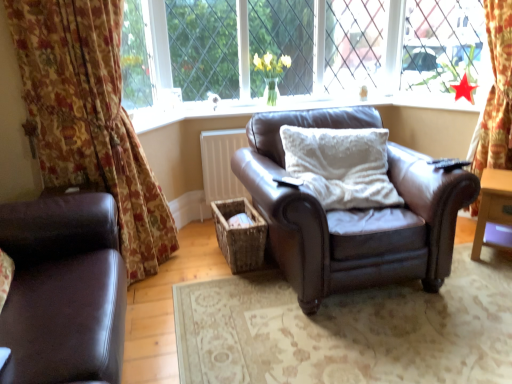
What do you see at coordinates (289, 107) in the screenshot? I see `matte brown leather armchair at center` at bounding box center [289, 107].

This screenshot has height=384, width=512. What do you see at coordinates (89, 117) in the screenshot?
I see `floral fabric curtain at left` at bounding box center [89, 117].

Measure the distance between point (x=441, y=24) and camera.

The distance of point (x=441, y=24) from camera is 10.40 feet.

Find the location of a particular element. The width and height of the screenshot is (512, 384). matte brown leather armchair at center is located at coordinates (289, 107).

Which of these two, woven brown basket at center or floral fabric curtain at left, is bigger?

floral fabric curtain at left.

Is point (225, 211) positioned behind point (72, 152)?

Yes, point (225, 211) is behind point (72, 152).

From a real-world perspective, who is located higher, woven brown basket at center or floral fabric curtain at left?

From a 3D spatial view, floral fabric curtain at left is above.

Is woven brown basket at center surrounding floral fabric curtain at left?

No, floral fabric curtain at left is not inside woven brown basket at center.

Considering the positions of objects yellow glass vase at upper center and woven brown basket at center in the image provided, who is more to the left, yellow glass vase at upper center or woven brown basket at center?

From the viewer's perspective, woven brown basket at center appears more on the left side.

Is yellow glass vase at upper center turned away from woven brown basket at center?

No, yellow glass vase at upper center is not facing the opposite direction of woven brown basket at center.

Considering the relative sizes of yellow glass vase at upper center and woven brown basket at center in the image provided, is yellow glass vase at upper center wider than woven brown basket at center?

No.

Is yellow glass vase at upper center next to woven brown basket at center?

No, yellow glass vase at upper center is not beside woven brown basket at center.

Would you say clear glass window at center is outside brown leather chair at center?

Indeed, clear glass window at center is completely outside brown leather chair at center.

Who is smaller, clear glass window at center or brown leather chair at center?

Smaller between the two is clear glass window at center.

From a real-world perspective, is clear glass window at center on top of brown leather chair at center?

Yes, from a real-world perspective, clear glass window at center is over brown leather chair at center

Does brown leather chair at center have a lesser width compared to matte brown leather armchair at center?

Incorrect, the width of brown leather chair at center is not less than that of matte brown leather armchair at center.

Considering the sizes of objects brown leather chair at center and matte brown leather armchair at center in the image provided, who is taller, brown leather chair at center or matte brown leather armchair at center?

brown leather chair at center is taller.

Is brown leather chair at center directly adjacent to matte brown leather armchair at center?

No, brown leather chair at center is not making contact with matte brown leather armchair at center.

In terms of size, does brown leather chair at center appear bigger or smaller than matte brown leather armchair at center?

In the image, brown leather chair at center appears to be larger than matte brown leather armchair at center.

Is metallic mesh at upper right oriented away from clear glass window at center?

No.

Considering the relative sizes of metallic mesh at upper right and clear glass window at center in the image provided, is metallic mesh at upper right taller than clear glass window at center?

No.

Does metallic mesh at upper right appear on the left side of clear glass window at center?

In fact, metallic mesh at upper right is to the right of clear glass window at center.

Is metallic mesh at upper right inside the boundaries of clear glass window at center, or outside?

metallic mesh at upper right is not enclosed by clear glass window at center.

From the image's perspective, between floral fabric curtain at left and clear glass window at center, which one is located above?

clear glass window at center.

Is floral fabric curtain at left facing away from clear glass window at center?

No, floral fabric curtain at left is not facing the opposite direction of clear glass window at center.

From their relative heights in the image, would you say floral fabric curtain at left is taller or shorter than clear glass window at center?

In the image, floral fabric curtain at left appears to be taller than clear glass window at center.

Which object is positioned more to the left, floral fabric curtain at left or clear glass window at center?

floral fabric curtain at left is more to the left.

Is matte brown leather armchair at center not within white fluffy pillow at center?

matte brown leather armchair at center lies outside white fluffy pillow at center's area.

In terms of width, does matte brown leather armchair at center look wider or thinner when compared to white fluffy pillow at center?

Clearly, matte brown leather armchair at center has less width compared to white fluffy pillow at center.

Is point (142, 118) positioned in front of point (297, 161)?

No, it is not.

At what (x,y) coordinates should I click in order to perform the action: click on pillow in front of the matte brown leather armchair at center. Please return your answer as a coordinate pair (x, y). Looking at the image, I should click on (341, 165).

Find the location of a particular element. curtain lying on the left of woven brown basket at center is located at coordinates (89, 117).

Locate an element on the screen. The width and height of the screenshot is (512, 384). flower located on the right of woven brown basket at center is located at coordinates (271, 73).

Estimate the real-world distances between objects in this image. Which object is closer to matte brown leather armchair at center, yellow glass vase at upper center or wooden side table at right?

Among the two, yellow glass vase at upper center is located nearer to matte brown leather armchair at center.

Which object lies further to the anchor point woven brown basket at center, yellow glass vase at upper center or matte brown leather armchair at left?

yellow glass vase at upper center lies further to woven brown basket at center than the other object.

Looking at the image, which one is located closer to wooden side table at right, woven brown basket at center or matte brown leather armchair at left?

woven brown basket at center lies closer to wooden side table at right than the other object.

Based on their spatial positions, is brown leather chair at center or clear glass window at center further from wooden side table at right?

clear glass window at center is positioned further to the anchor wooden side table at right.

When comparing their distances from yellow glass vase at upper center, does metallic mesh at upper right or matte brown leather armchair at center seem closer?

Among the two, matte brown leather armchair at center is located nearer to yellow glass vase at upper center.

From the picture: Considering their positions, is matte brown leather armchair at center positioned further to brown leather chair at center than floral fabric curtain at left?

The object further to brown leather chair at center is floral fabric curtain at left.

Estimate the real-world distances between objects in this image. Which object is closer to woven brown basket at center, wooden side table at right or clear glass window at center?

clear glass window at center is positioned closer to the anchor woven brown basket at center.

From the image, which object appears to be nearer to matte brown leather armchair at center, clear glass window at center or white fluffy pillow at center?

Among the two, clear glass window at center is located nearer to matte brown leather armchair at center.

I want to click on window sill located between white fluffy pillow at center and yellow glass vase at upper center in the depth direction, so click(289, 107).

Where is `window between brown leather chair at center and matte brown leather armchair at center from front to back`? The image size is (512, 384). window between brown leather chair at center and matte brown leather armchair at center from front to back is located at coordinates (386, 49).

At what (x,y) coordinates should I click in order to perform the action: click on window sill between clear glass window at center and metallic mesh at upper right from left to right. Please return your answer as a coordinate pair (x, y). The image size is (512, 384). Looking at the image, I should click on (289, 107).

The height and width of the screenshot is (384, 512). Find the location of `curtain between clear glass window at center and woven brown basket at center vertically`. curtain between clear glass window at center and woven brown basket at center vertically is located at coordinates (89, 117).